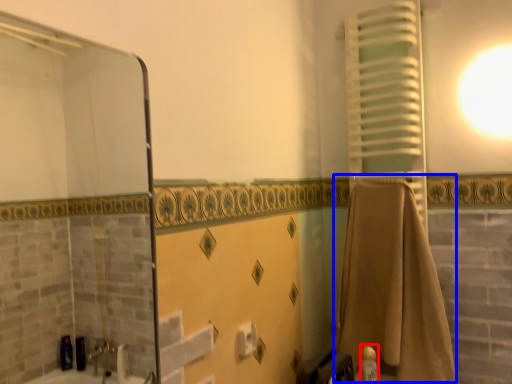
Question: Which object appears closest to the camera in this image, toiletry (highlighted by a red box) or bath towel (highlighted by a blue box)?

Choices:
 (A) toiletry
 (B) bath towel

Answer: (B)